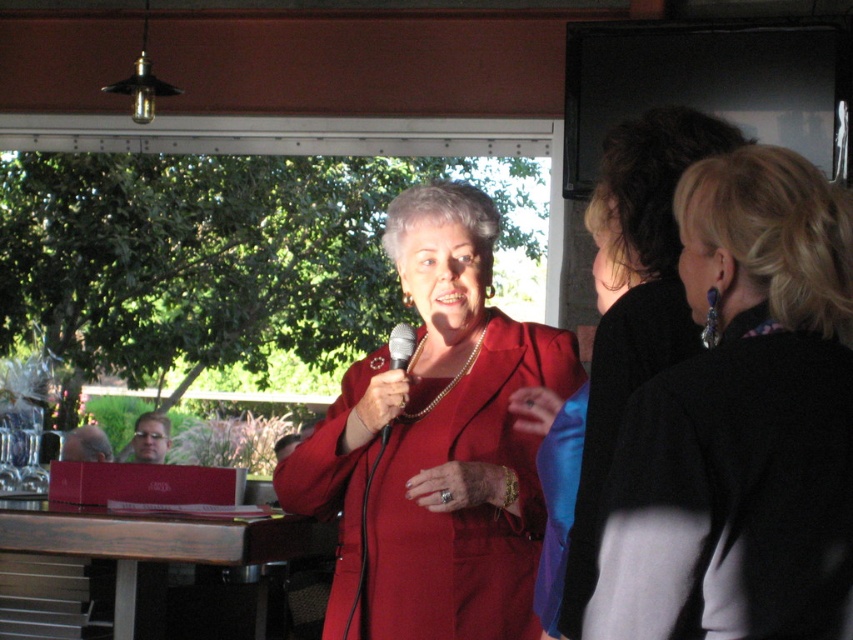
Question: Estimate the real-world distances between objects in this image. Which object is closer to the matte red suit at center?

Choices:
 (A) matte red blazer at center
 (B) metallic silver microphone at center

Answer: (B)

Question: Estimate the real-world distances between objects in this image. Which object is closer to the black fabric jacket at upper right?

Choices:
 (A) metallic silver microphone at center
 (B) matte red blazer at center
 (C) matte red suit at center

Answer: (B)

Question: Which point is closer to the camera?

Choices:
 (A) (409, 358)
 (B) (415, 282)
 (C) (688, 461)
 (D) (589, 497)

Answer: (C)

Question: Does matte red suit at center appear over matte red blazer at center?

Choices:
 (A) yes
 (B) no

Answer: (B)

Question: Can you confirm if black fabric jacket at upper right is positioned to the left of metallic silver microphone at center?

Choices:
 (A) yes
 (B) no

Answer: (B)

Question: Is matte red suit at center wider than matte red blazer at center?

Choices:
 (A) yes
 (B) no

Answer: (A)